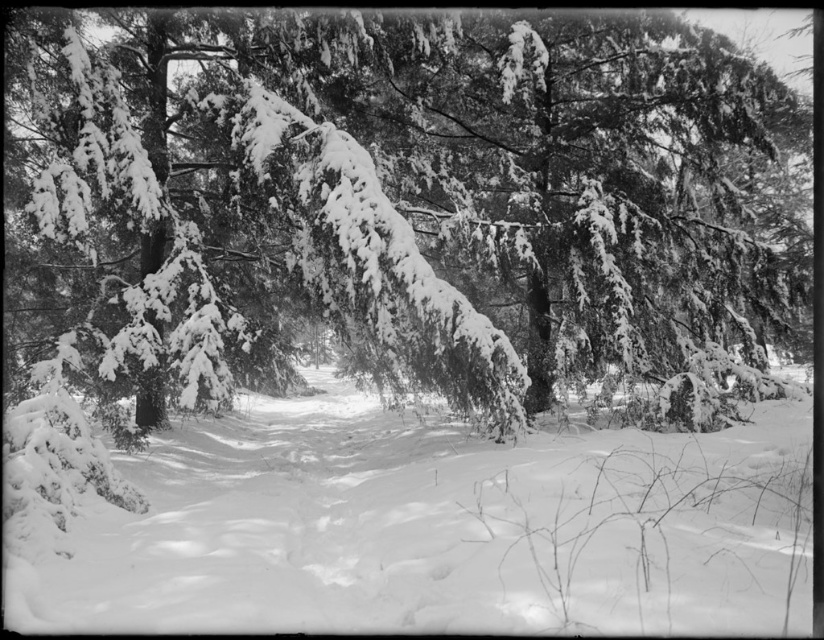
Question: Can you confirm if snow-covered evergreen at center is thinner than white fluffy snow at center?

Choices:
 (A) yes
 (B) no

Answer: (B)

Question: Which point is farther to the camera?

Choices:
 (A) (87, 595)
 (B) (207, 147)

Answer: (B)

Question: Considering the relative positions of snow-covered evergreen at center and white fluffy snow at center in the image provided, where is snow-covered evergreen at center located with respect to white fluffy snow at center?

Choices:
 (A) below
 (B) above

Answer: (B)

Question: From the image, what is the correct spatial relationship of snow-covered evergreen at center in relation to white fluffy snow at center?

Choices:
 (A) above
 (B) below

Answer: (A)

Question: Which point appears farthest from the camera in this image?

Choices:
 (A) (673, 323)
 (B) (284, 506)

Answer: (A)